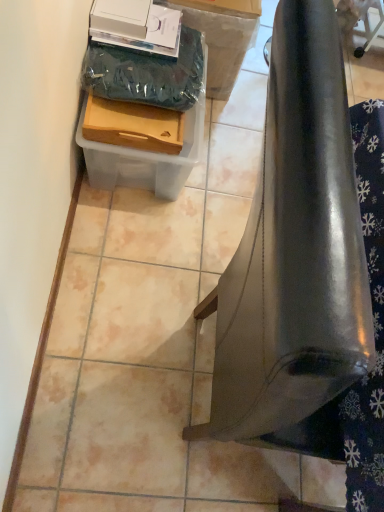
Locate an element on the screen. free space above wooden tray at lower left, the 2th box viewed from the back (from a real-world perspective) is located at coordinates (139, 93).